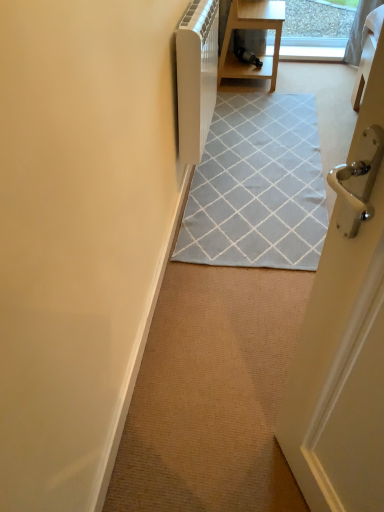
Question: Is white plastic radiator at upper center inside or outside of white matte door at left?

Choices:
 (A) inside
 (B) outside

Answer: (B)

Question: Considering the positions of white plastic radiator at upper center and white matte door at left in the image, is white plastic radiator at upper center taller or shorter than white matte door at left?

Choices:
 (A) short
 (B) tall

Answer: (B)

Question: Considering the real-world distances, which object is closest to the carpet at center?

Choices:
 (A) white matte door at left
 (B) wooden table at upper center
 (C) light gray woven rug at center
 (D) white plastic radiator at upper center

Answer: (A)

Question: Estimate the real-world distances between objects in this image. Which object is farther from the wooden table at upper center?

Choices:
 (A) white matte door at left
 (B) white plastic radiator at upper center
 (C) light gray woven rug at center
 (D) carpet at center

Answer: (D)